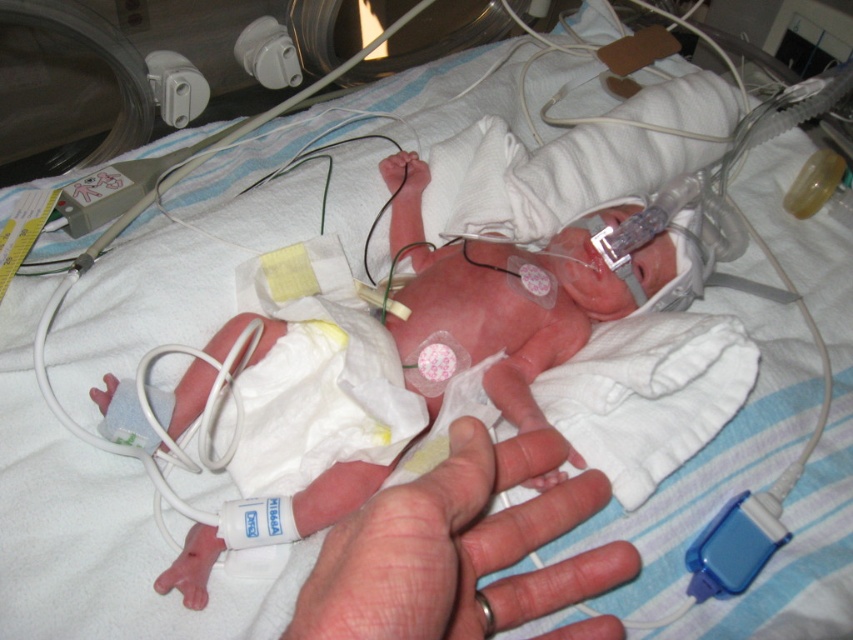
Is point (469, 497) more distant than point (480, 595)?

No.

Does smooth skin hand at center appear on the left side of rubber teething ring at lower center?

Correct, you'll find smooth skin hand at center to the left of rubber teething ring at lower center.

Between point (595, 492) and point (490, 625), which one is positioned behind?

The point (595, 492) is behind.

You are a GUI agent. You are given a task and a screenshot of the screen. Output one action in this format:
    pyautogui.click(x=<x>, y=<y>)
    Task: Click on the smooth skin hand at center
    The height and width of the screenshot is (640, 853).
    Given the screenshot: What is the action you would take?
    pyautogui.click(x=440, y=540)